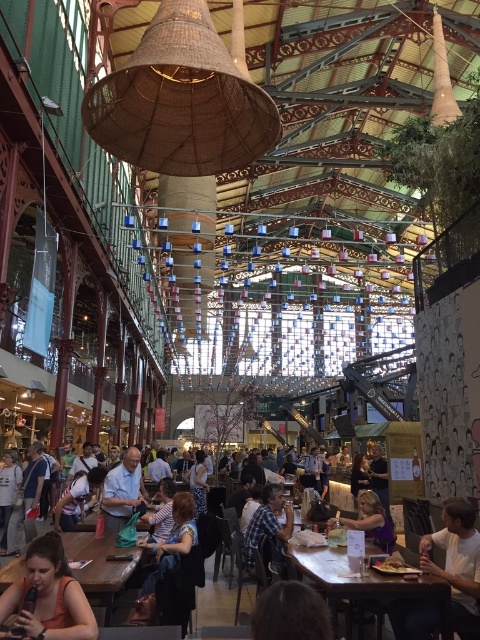
Who is lower down, brown hair at lower center or light blue shirt at center?

light blue shirt at center

Between brown hair at lower center and light blue shirt at center, which one appears on the right side from the viewer's perspective?

From the viewer's perspective, brown hair at lower center appears more on the right side.

Who is more forward, (x=252, y=621) or (x=120, y=516)?

Positioned in front is point (x=252, y=621).

In order to click on brown hair at lower center in this screenshot , I will do `click(290, 612)`.

Can you confirm if brown hair at lower center is taller than golden crispy fries at lower right?

Correct, brown hair at lower center is much taller as golden crispy fries at lower right.

Which of these two, brown hair at lower center or golden crispy fries at lower right, stands shorter?

With less height is golden crispy fries at lower right.

Is point (304, 595) in front of point (396, 570)?

Yes, point (304, 595) is closer to viewer.

The height and width of the screenshot is (640, 480). In order to click on brown hair at lower center in this screenshot , I will do `click(290, 612)`.

Which is more to the left, brown wooden table at lower left or purple matte dress at lower right?

brown wooden table at lower left

Who is more distant from viewer, [72,548] or [368,512]?

The point [368,512] is behind.

Who is more forward, (11, 564) or (361, 509)?

Point (11, 564)

Find the location of a particular element. This screenshot has height=640, width=480. brown wooden table at lower left is located at coordinates (99, 564).